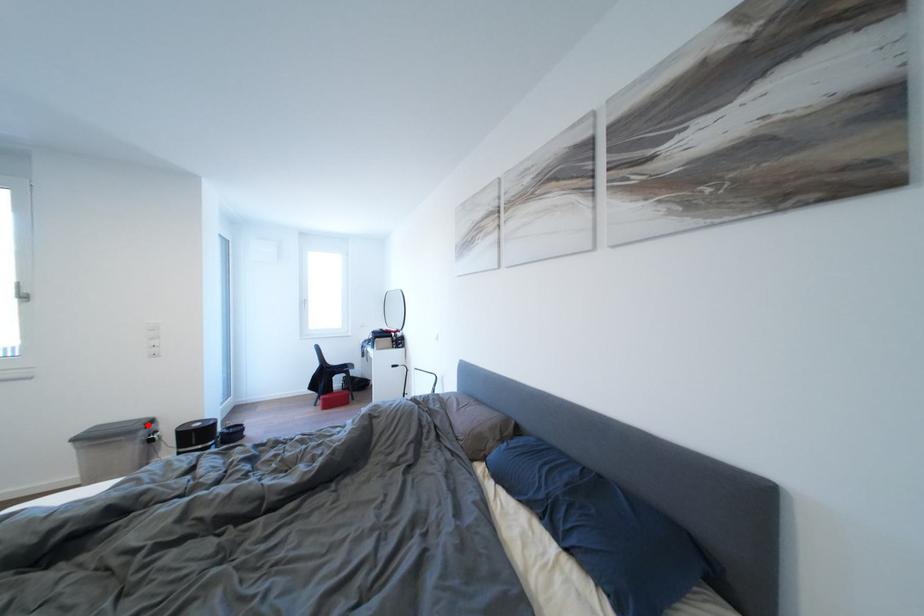
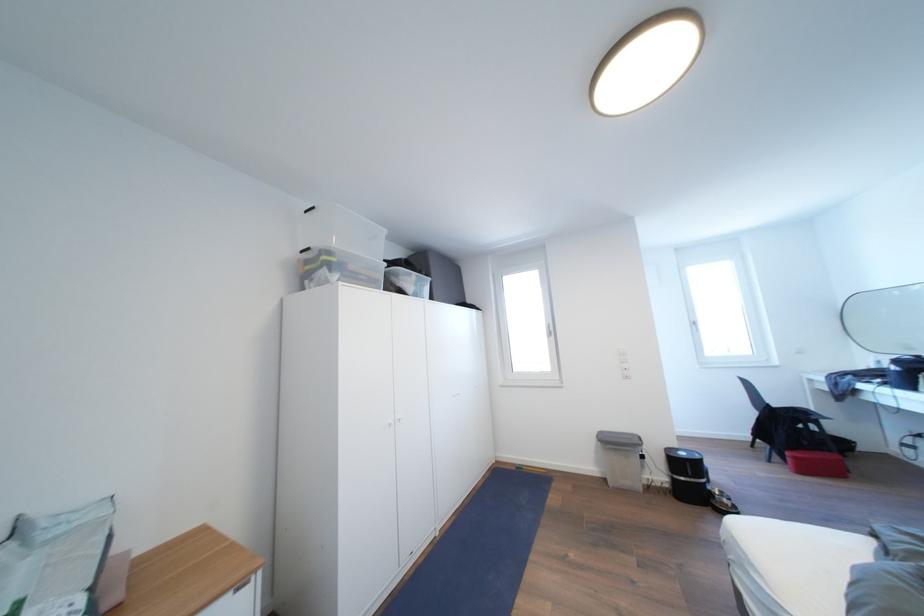
Where in the second image is the point corresponding to the highlighted location from the first image?

(639, 440)